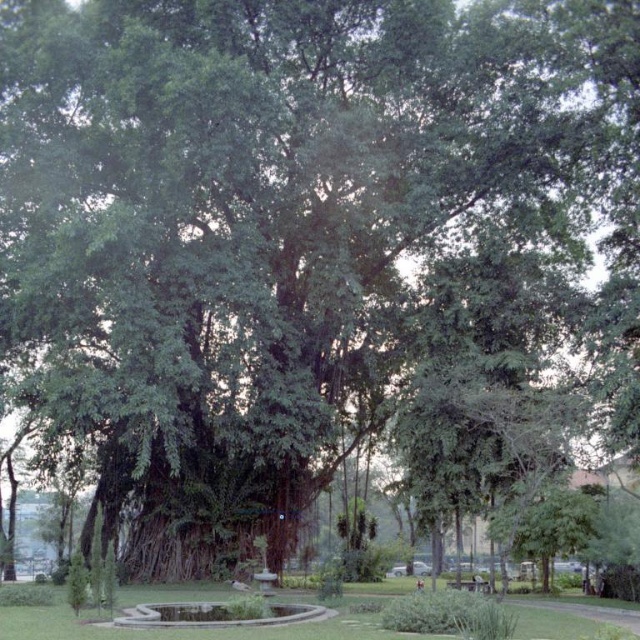
You are standing in front of the large banyan tree and looking at two points marked on the tree. The first point is at coordinates point (380, 611) and the second point is at point (484, 592). Which of these two points is nearer to you?

Point (380, 611) is closer to the camera than point (484, 592), so the first point is nearer to you.

You are standing in a park where the large banyan tree is located. You notice a point marked at coordinates [202,628]. What is located at that point?

The point at coordinates [202,628] marks green grass at center.